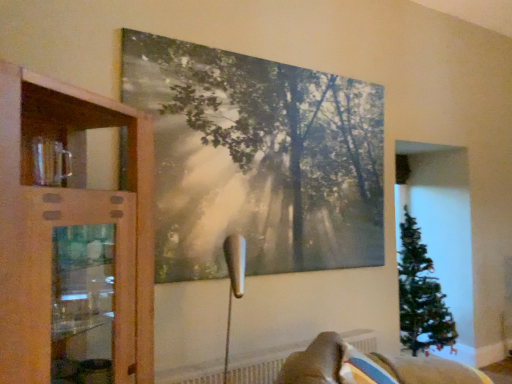
Question: Should I look upward or downward to see velvet beige sofa at lower right?

Choices:
 (A) up
 (B) down

Answer: (B)

Question: Is wooden cabinet at left aimed at matte canvas painting at upper center?

Choices:
 (A) no
 (B) yes

Answer: (A)

Question: Does wooden cabinet at left have a greater height compared to matte canvas painting at upper center?

Choices:
 (A) no
 (B) yes

Answer: (A)

Question: From a real-world perspective, is wooden cabinet at left physically above matte canvas painting at upper center?

Choices:
 (A) no
 (B) yes

Answer: (A)

Question: Is wooden cabinet at left with matte canvas painting at upper center?

Choices:
 (A) yes
 (B) no

Answer: (B)

Question: Is wooden cabinet at left shorter than matte canvas painting at upper center?

Choices:
 (A) yes
 (B) no

Answer: (A)

Question: Is wooden cabinet at left not close to matte canvas painting at upper center?

Choices:
 (A) no
 (B) yes

Answer: (A)

Question: Can you confirm if velvet beige sofa at lower right is smaller than matte canvas painting at upper center?

Choices:
 (A) no
 (B) yes

Answer: (A)

Question: Is velvet beige sofa at lower right not close to matte canvas painting at upper center?

Choices:
 (A) no
 (B) yes

Answer: (B)

Question: Is velvet beige sofa at lower right positioned with its back to matte canvas painting at upper center?

Choices:
 (A) no
 (B) yes

Answer: (A)

Question: Does velvet beige sofa at lower right contain matte canvas painting at upper center?

Choices:
 (A) no
 (B) yes

Answer: (A)

Question: Considering the relative sizes of velvet beige sofa at lower right and matte canvas painting at upper center in the image provided, is velvet beige sofa at lower right wider than matte canvas painting at upper center?

Choices:
 (A) no
 (B) yes

Answer: (B)

Question: Is velvet beige sofa at lower right thinner than matte canvas painting at upper center?

Choices:
 (A) yes
 (B) no

Answer: (B)

Question: From a real-world perspective, is velvet beige sofa at lower right positioned over white textured radiator at lower center based on gravity?

Choices:
 (A) no
 (B) yes

Answer: (B)